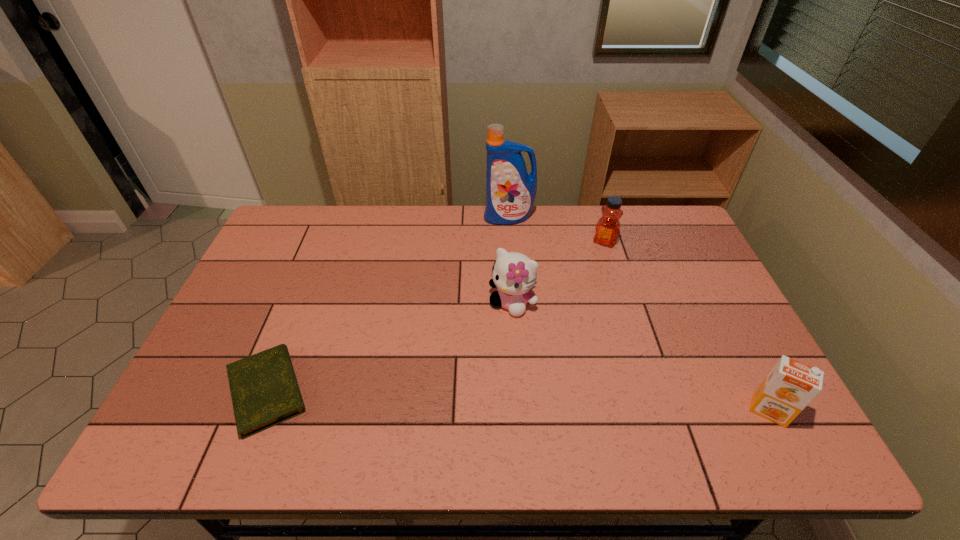
You are a GUI agent. You are given a task and a screenshot of the screen. Output one action in this format:
    pyautogui.click(x=<x>, y=<y>)
    Task: Click on the vacant space situated 0.280m on the front-facing side of the third nearest object
    
    Given the screenshot: What is the action you would take?
    pyautogui.click(x=444, y=392)

Locate an element on the screen. The width and height of the screenshot is (960, 540). vacant space located on the front-facing side of the third nearest object is located at coordinates (472, 354).

Find the location of `vacant point located on the front-facing side of the third nearest object`. vacant point located on the front-facing side of the third nearest object is located at coordinates (448, 386).

Identify the location of free space located 0.180m on the front label of the honey. (582, 281).

Locate an element on the screen. vacant space situated on the front label of the honey is located at coordinates (562, 316).

At what (x,y) coordinates should I click in order to perform the action: click on vacant space located on the front label of the honey. Please return your answer as a coordinate pair (x, y). Image resolution: width=960 pixels, height=540 pixels. Looking at the image, I should click on (576, 292).

Where is `free space located on the label of the farthest object`? This screenshot has height=540, width=960. free space located on the label of the farthest object is located at coordinates (499, 271).

What are the coordinates of `free region located 0.290m on the label of the farthest object` in the screenshot? It's located at (497, 284).

Where is `free space located 0.180m on the label of the farthest object`? Image resolution: width=960 pixels, height=540 pixels. free space located 0.180m on the label of the farthest object is located at coordinates (500, 260).

Where is `honey located in the far edge section of the desktop`? honey located in the far edge section of the desktop is located at coordinates (607, 228).